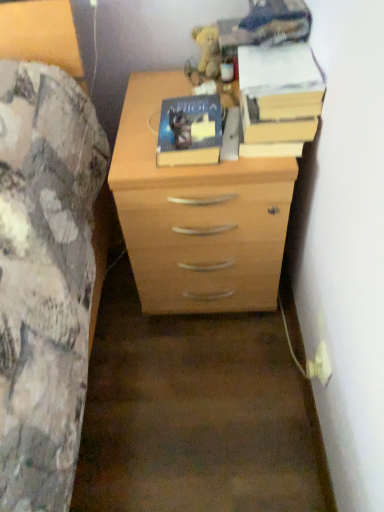
The height and width of the screenshot is (512, 384). I want to click on vacant region to the left of hardcover book at center, which appears as the first paperback book when viewed from the left, so click(135, 146).